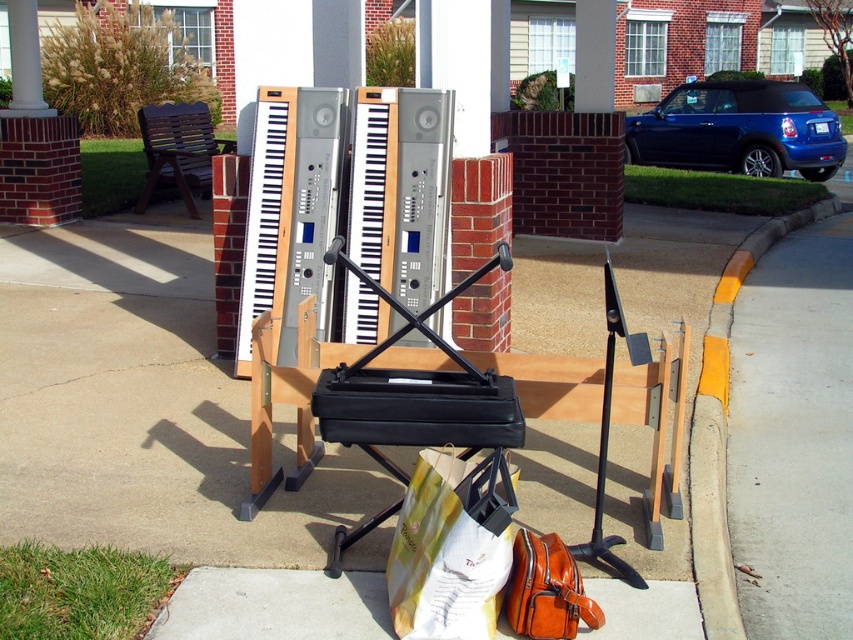
Question: Is white paper bag at center to the left of yellow painted curb at lower right from the viewer's perspective?

Choices:
 (A) no
 (B) yes

Answer: (B)

Question: Among these points, which one is farthest from the camera?

Choices:
 (A) (392, 156)
 (B) (503, 540)
 (C) (712, 448)

Answer: (A)

Question: Does leather handbag at lower center appear on the right side of brown leather bag at lower center?

Choices:
 (A) no
 (B) yes

Answer: (A)

Question: Is white paper bag at center below yellow painted curb at lower right?

Choices:
 (A) no
 (B) yes

Answer: (B)

Question: Which is nearer to the brown leather bag at lower center?

Choices:
 (A) white paper bag at center
 (B) brown wooden chair at upper left
 (C) yellow painted curb at lower right

Answer: (A)

Question: Which object appears farthest from the camera in this image?

Choices:
 (A) white paper bag at center
 (B) leather handbag at lower center
 (C) yellow painted curb at lower right
 (D) brown wooden chair at upper left

Answer: (D)